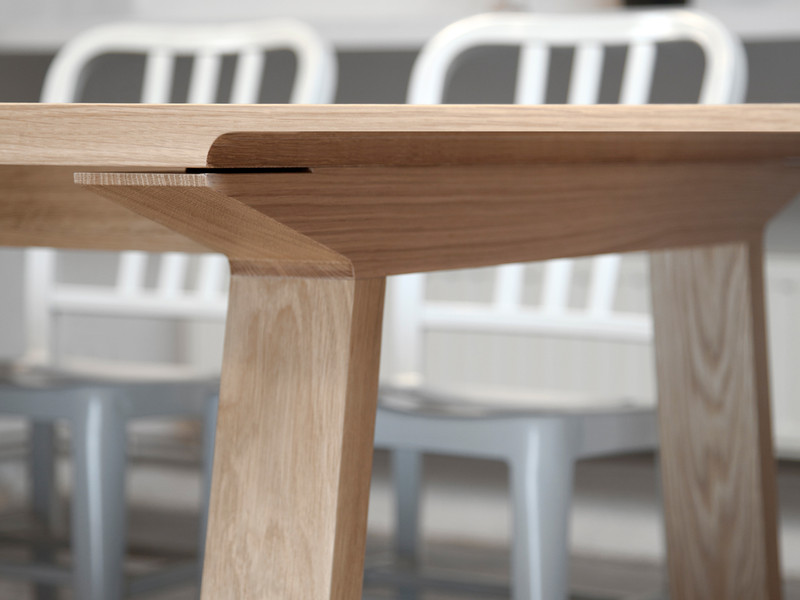
Find the location of a particular element. This screenshot has width=800, height=600. area below the table top is located at coordinates (138, 276).